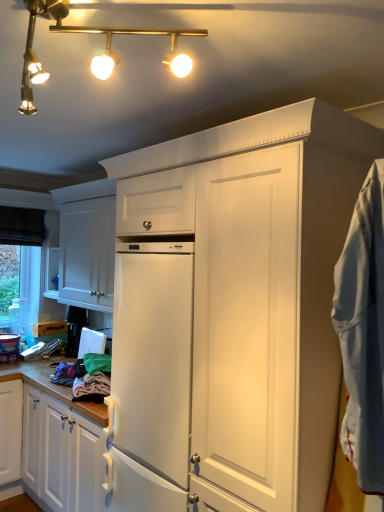
Where is `vacant area on top of gold metallic track lights at upper left (from a real-world perspective)`? The image size is (384, 512). vacant area on top of gold metallic track lights at upper left (from a real-world perspective) is located at coordinates (97, 29).